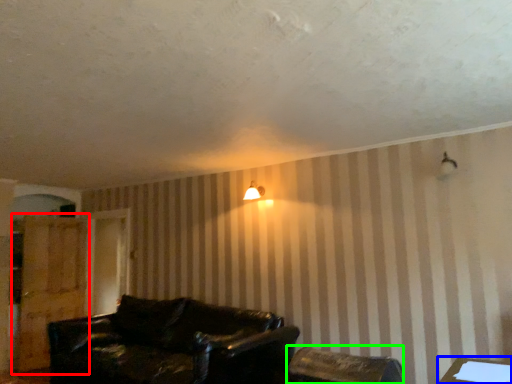
Question: Which is nearer to the dresser (highlighted by a red box)? table (highlighted by a blue box) or chair (highlighted by a green box).

Choices:
 (A) table
 (B) chair

Answer: (B)